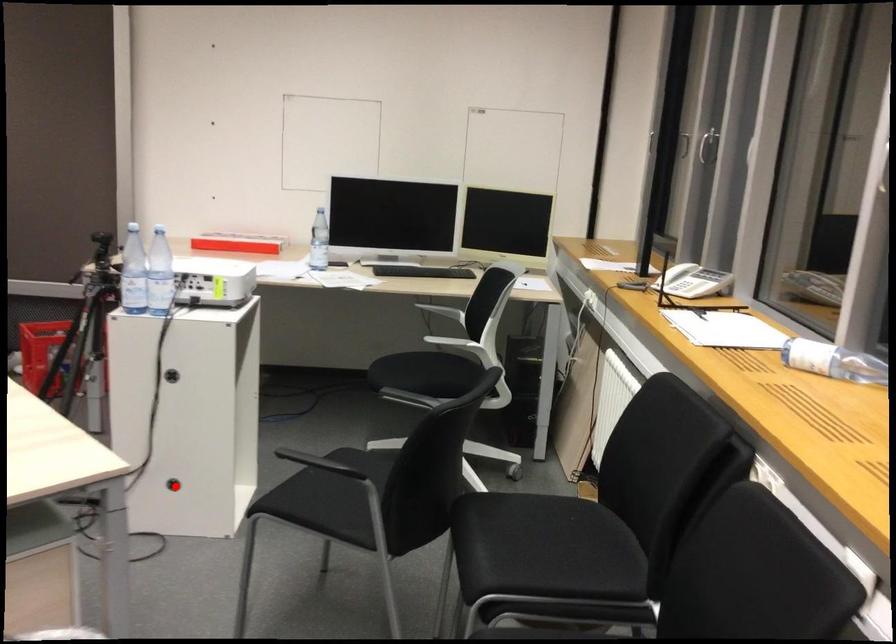
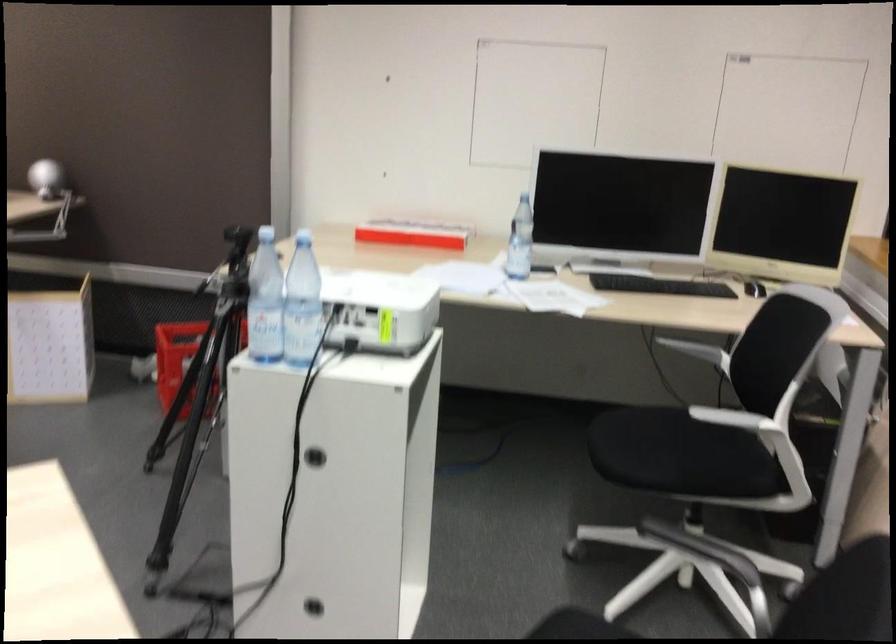
In the second image, find the point that corresponds to the highlighted location in the first image.

(313, 607)